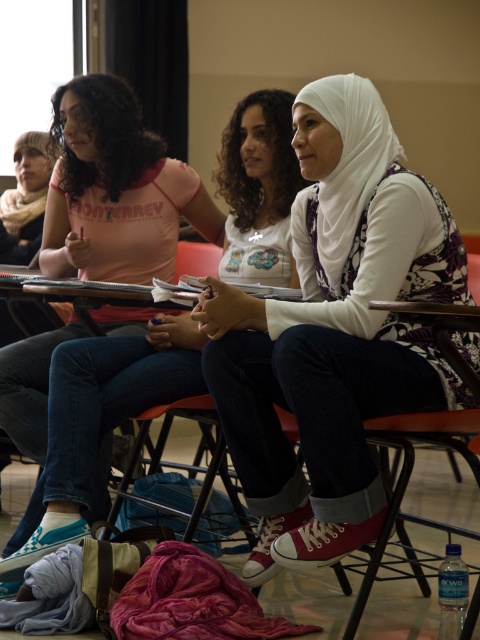
You are a photographer trying to capture a closeup of the white cotton hijab at center and the metallic red chair at center. Since you want to focus on the hijab, which object should you position closer to the camera?

The white cotton hijab at center has a greater height compared to the metallic red chair at center, so to focus on the hijab, you should position the white cotton hijab at center closer to the camera.